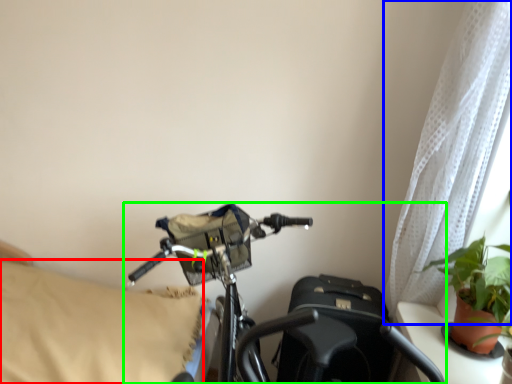
Question: Which object is the farthest from pillow (highlighted by a red box)? Choose among these: curtain (highlighted by a blue box) or bicycle (highlighted by a green box).

Choices:
 (A) curtain
 (B) bicycle

Answer: (A)